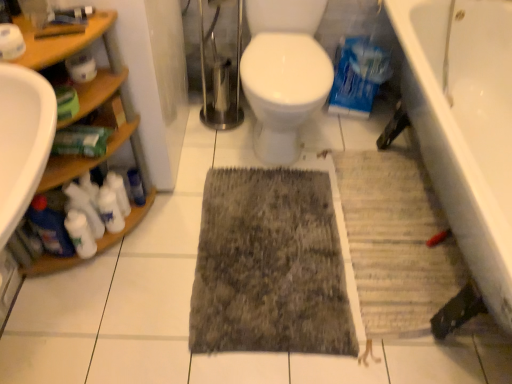
Identify the location of free area in between white matte cleaning products at lower left, which is counted as the 3th cleaning product, starting from the left, and gray textured bath mat at lower right. (266, 236).